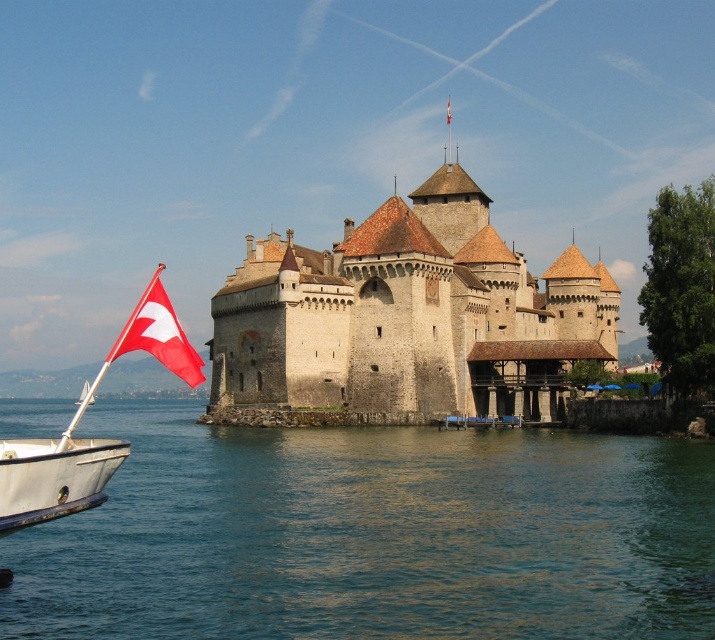
You are standing on the dock near Chateaude Chillon and see the clear blue water at lower left and the red fabric flag at center. Which object is positioned to the left of the other?

The clear blue water at lower left is to the left of the red fabric flag at center.

From the picture: You are a photographer planning to capture the Chateux de Chillon with both the red fabric flag at left and the red fabric flag at center in the frame. Which flag should you focus on to ensure it appears larger in your photo?

The red fabric flag at left is much taller than the red fabric flag at center, so focusing on it will make it appear larger in the photo.